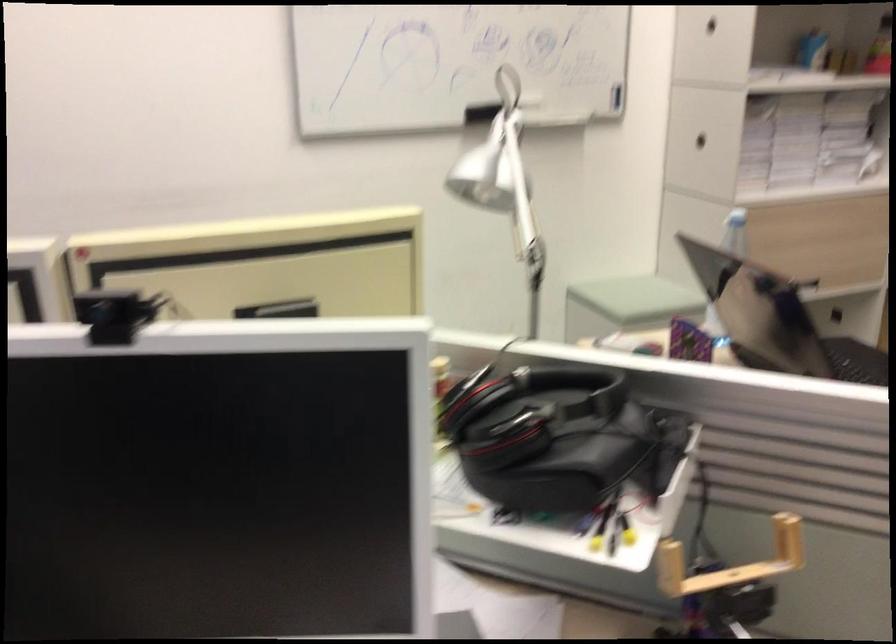
Where is `black headphones`? black headphones is located at coordinates (557, 438).